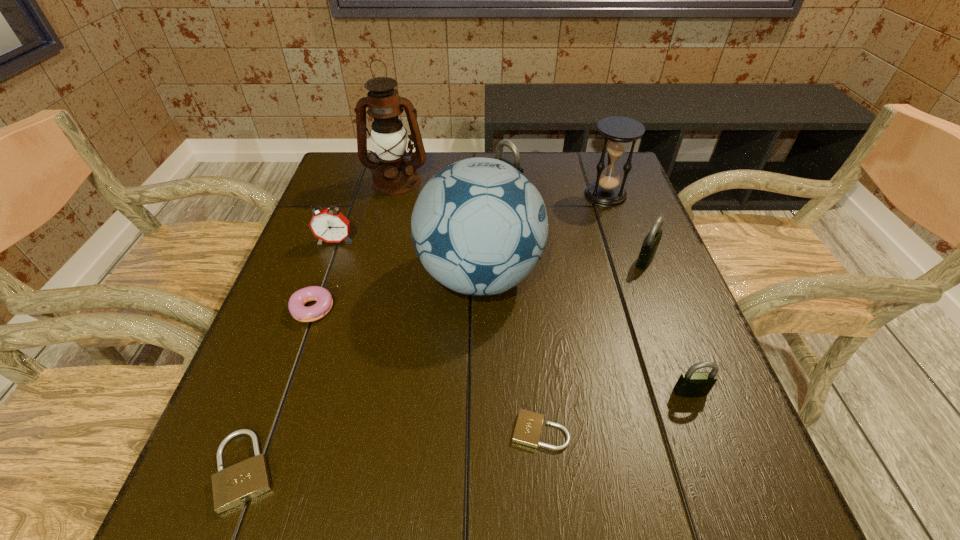
You are a GUI agent. You are given a task and a screenshot of the screen. Output one action in this format:
    pyautogui.click(x=<x>, y=<y>)
    Task: Click on the free region located on the side with brand of the blue soccer ball
    
    Given the screenshot: What is the action you would take?
    pyautogui.click(x=612, y=276)

At what (x,y) coordinates should I click in order to perform the action: click on vacant area located 0.100m on the back of the third tallest object. Please return your answer as a coordinate pair (x, y). Looking at the image, I should click on (595, 165).

I want to click on blank space located 0.230m on the front of the tallest padlock, so click(511, 255).

Find the location of a particular element. This screenshot has height=540, width=960. vacant space located 0.080m on the back of the second smallest black padlock is located at coordinates (634, 228).

Locate an element on the screen. vacant area situated on the clock face of the alarm clock is located at coordinates (311, 309).

Where is `free space located 0.180m on the back of the third nearest object`? This screenshot has height=540, width=960. free space located 0.180m on the back of the third nearest object is located at coordinates (660, 310).

Find the location of a particular element. This screenshot has width=960, height=540. vacant region located on the back of the third shortest object is located at coordinates (331, 258).

You are a GUI agent. You are given a task and a screenshot of the screen. Output one action in this format:
    pyautogui.click(x=<x>, y=<y>)
    Task: Click on the free space located 0.140m on the right of the second shortest object
    
    Given the screenshot: What is the action you would take?
    pyautogui.click(x=368, y=470)

Where is `vacant space located on the front of the smaller beige padlock`? This screenshot has width=960, height=540. vacant space located on the front of the smaller beige padlock is located at coordinates (547, 505).

Find the location of a particular element. Image resolution: width=960 pixels, height=540 pixels. lantern at the far edge is located at coordinates (394, 175).